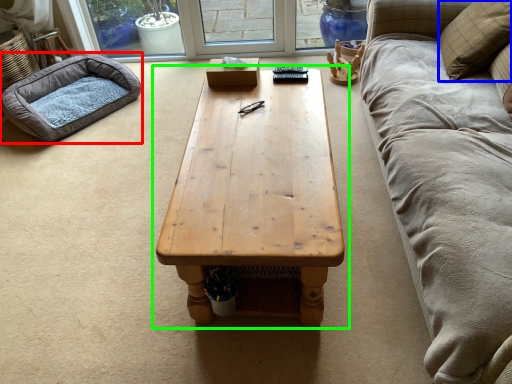
Question: Which object is positioned closest to dog bed (highlighted by a red box)? Select from pillow (highlighted by a blue box) and coffee table (highlighted by a green box).

Choices:
 (A) pillow
 (B) coffee table

Answer: (B)